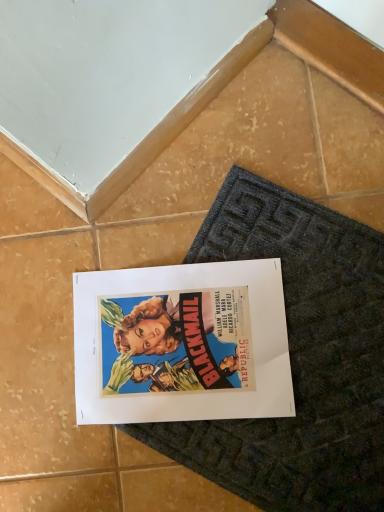
Question: Can you confirm if matte paper poster at center is smaller than dark gray textured bath mat at center?

Choices:
 (A) no
 (B) yes

Answer: (B)

Question: From a real-world perspective, is matte paper poster at center located beneath dark gray textured bath mat at center?

Choices:
 (A) yes
 (B) no

Answer: (B)

Question: Can you confirm if matte paper poster at center is thinner than dark gray textured bath mat at center?

Choices:
 (A) no
 (B) yes

Answer: (B)

Question: Is matte paper poster at center outside of dark gray textured bath mat at center?

Choices:
 (A) no
 (B) yes

Answer: (A)

Question: Is matte paper poster at center shorter than dark gray textured bath mat at center?

Choices:
 (A) yes
 (B) no

Answer: (B)

Question: Is matte paper poster at center in contact with dark gray textured bath mat at center?

Choices:
 (A) no
 (B) yes

Answer: (B)

Question: From the image's perspective, is dark gray textured bath mat at center on matte paper poster at center?

Choices:
 (A) yes
 (B) no

Answer: (B)

Question: Considering the relative positions of dark gray textured bath mat at center and matte paper poster at center in the image provided, is dark gray textured bath mat at center to the right of matte paper poster at center from the viewer's perspective?

Choices:
 (A) no
 (B) yes

Answer: (B)

Question: Can you confirm if dark gray textured bath mat at center is taller than matte paper poster at center?

Choices:
 (A) yes
 (B) no

Answer: (B)

Question: Considering the relative sizes of dark gray textured bath mat at center and matte paper poster at center in the image provided, is dark gray textured bath mat at center bigger than matte paper poster at center?

Choices:
 (A) yes
 (B) no

Answer: (A)

Question: Can you confirm if dark gray textured bath mat at center is wider than matte paper poster at center?

Choices:
 (A) yes
 (B) no

Answer: (A)

Question: Is there a large distance between dark gray textured bath mat at center and matte paper poster at center?

Choices:
 (A) yes
 (B) no

Answer: (B)

Question: Would you say dark gray textured bath mat at center is to the left or to the right of matte paper poster at center in the picture?

Choices:
 (A) left
 (B) right

Answer: (B)